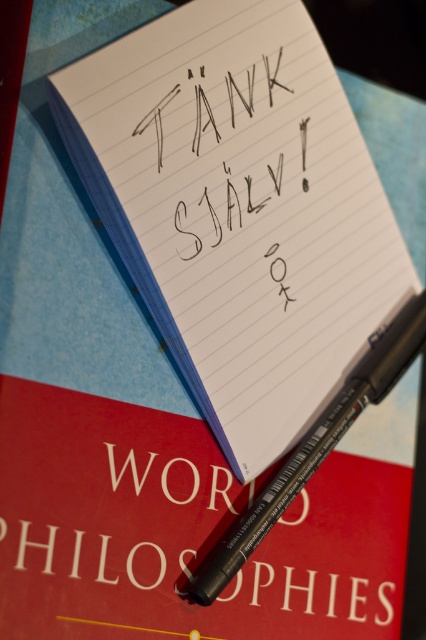
Is white lined paper at center above black matte pen at lower center?

Indeed, white lined paper at center is positioned over black matte pen at lower center.

What do you see at coordinates (239, 209) in the screenshot?
I see `white lined paper at center` at bounding box center [239, 209].

This screenshot has height=640, width=426. What do you see at coordinates (239, 209) in the screenshot?
I see `white lined paper at center` at bounding box center [239, 209].

The image size is (426, 640). I want to click on white lined paper at center, so click(239, 209).